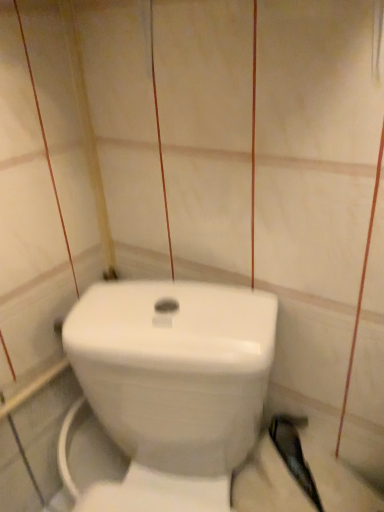
What do you see at coordinates (174, 383) in the screenshot?
I see `white glossy toilet at center` at bounding box center [174, 383].

The width and height of the screenshot is (384, 512). In order to click on white glossy toilet at center in this screenshot , I will do `click(174, 383)`.

Locate an element on the screen. white glossy toilet at center is located at coordinates (174, 383).